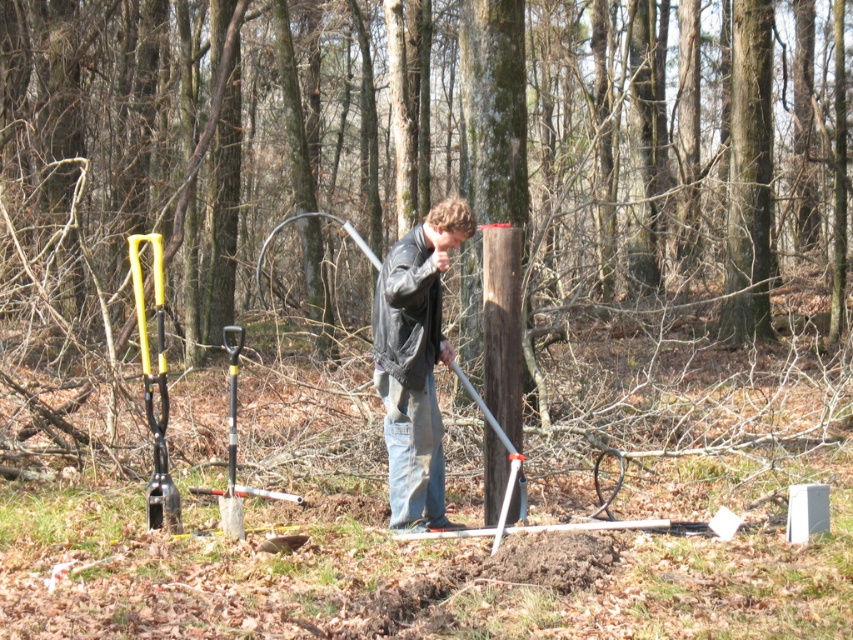
You are a hiker who just arrived at the wooded area. You see a leather jacket at center and a metallic yellow tool at left. Which item is bigger in size?

The leather jacket at center is larger in size compared to the metallic yellow tool at left.

You are a hiker who wants to know which item is wider when comparing the leather jacket at center and the metallic yellow tool at left. Can you tell me which one is wider?

The leather jacket at center is wider than the metallic yellow tool at left.